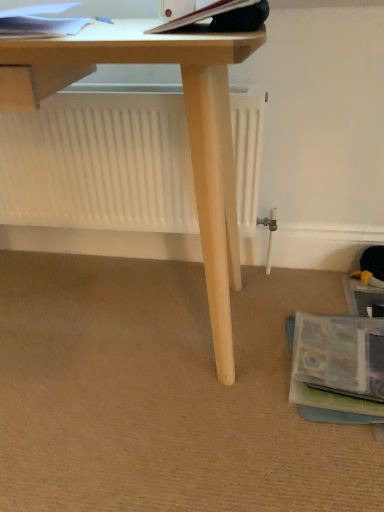
Identify the location of matte paper at upper left, placed as the second paperback book when sorted from right to left. (40, 27).

Image resolution: width=384 pixels, height=512 pixels. Describe the element at coordinates (40, 27) in the screenshot. I see `matte paper at upper left, placed as the second paperback book when sorted from right to left` at that location.

This screenshot has width=384, height=512. Find the location of `hardcover book at upper center, the second paperback book when ordered from left to right`. hardcover book at upper center, the second paperback book when ordered from left to right is located at coordinates (201, 15).

Describe the element at coordinates (201, 15) in the screenshot. The height and width of the screenshot is (512, 384). I see `hardcover book at upper center, the second paperback book when ordered from left to right` at that location.

Locate an element on the screen. The width and height of the screenshot is (384, 512). matte paper at upper left, marked as the 1th paperback book in a left-to-right arrangement is located at coordinates (40, 27).

Consider the image. Which object is positioned more to the left, hardcover book at upper center, marked as the 1th paperback book in a right-to-left arrangement, or matte paper at upper left, marked as the 1th paperback book in a left-to-right arrangement?

matte paper at upper left, marked as the 1th paperback book in a left-to-right arrangement, is more to the left.

In the scene shown: Is hardcover book at upper center, marked as the 1th paperback book in a right-to-left arrangement, positioned in front of matte paper at upper left, placed as the second paperback book when sorted from right to left?

Yes, hardcover book at upper center, marked as the 1th paperback book in a right-to-left arrangement, is closer to the camera.

Which is nearer, [153,30] or [52,25]?

Point [153,30] is positioned closer to the camera compared to point [52,25].

From the picture: From the image's perspective, is hardcover book at upper center, marked as the 1th paperback book in a right-to-left arrangement, above matte paper at upper left, marked as the 1th paperback book in a left-to-right arrangement?

Actually, hardcover book at upper center, marked as the 1th paperback book in a right-to-left arrangement, appears below matte paper at upper left, marked as the 1th paperback book in a left-to-right arrangement, in the image.

From a real-world perspective, is hardcover book at upper center, marked as the 1th paperback book in a right-to-left arrangement, located higher than matte paper at upper left, marked as the 1th paperback book in a left-to-right arrangement?

Yes, from a real-world perspective, hardcover book at upper center, marked as the 1th paperback book in a right-to-left arrangement, is on top of matte paper at upper left, marked as the 1th paperback book in a left-to-right arrangement.

Considering the relative sizes of hardcover book at upper center, the second paperback book when ordered from left to right, and matte paper at upper left, placed as the second paperback book when sorted from right to left, in the image provided, is hardcover book at upper center, the second paperback book when ordered from left to right, thinner than matte paper at upper left, placed as the second paperback book when sorted from right to left,?

Yes, hardcover book at upper center, the second paperback book when ordered from left to right, is thinner than matte paper at upper left, placed as the second paperback book when sorted from right to left.

Between hardcover book at upper center, the second paperback book when ordered from left to right, and matte paper at upper left, marked as the 1th paperback book in a left-to-right arrangement, which one has more height?

With more height is hardcover book at upper center, the second paperback book when ordered from left to right.

In terms of size, does hardcover book at upper center, the second paperback book when ordered from left to right, appear bigger or smaller than matte paper at upper left, placed as the second paperback book when sorted from right to left?

In the image, hardcover book at upper center, the second paperback book when ordered from left to right, appears to be smaller than matte paper at upper left, placed as the second paperback book when sorted from right to left.

Is matte paper at upper left, placed as the second paperback book when sorted from right to left, surrounded by hardcover book at upper center, the second paperback book when ordered from left to right?

That's incorrect, matte paper at upper left, placed as the second paperback book when sorted from right to left, is not inside hardcover book at upper center, the second paperback book when ordered from left to right.

Is hardcover book at upper center, marked as the 1th paperback book in a right-to-left arrangement, positioned far away from matte paper at upper left, marked as the 1th paperback book in a left-to-right arrangement?

That's not correct — hardcover book at upper center, marked as the 1th paperback book in a right-to-left arrangement, is a little close to matte paper at upper left, marked as the 1th paperback book in a left-to-right arrangement.

Could you tell me if hardcover book at upper center, the second paperback book when ordered from left to right, is turned towards matte paper at upper left, marked as the 1th paperback book in a left-to-right arrangement?

No.

How different are the orientations of hardcover book at upper center, the second paperback book when ordered from left to right, and matte paper at upper left, placed as the second paperback book when sorted from right to left, in degrees?

The angular difference between hardcover book at upper center, the second paperback book when ordered from left to right, and matte paper at upper left, placed as the second paperback book when sorted from right to left, is 16 degrees.

Measure the distance between hardcover book at upper center, the second paperback book when ordered from left to right, and matte paper at upper left, placed as the second paperback book when sorted from right to left.

hardcover book at upper center, the second paperback book when ordered from left to right, and matte paper at upper left, placed as the second paperback book when sorted from right to left, are 8.12 inches apart from each other.

What are the coordinates of `paperback book above the hardcover book at upper center, marked as the 1th paperback book in a right-to-left arrangement (from the image's perspective)` in the screenshot? It's located at (40, 27).

Is matte paper at upper left, marked as the 1th paperback book in a left-to-right arrangement, to the left or to the right of hardcover book at upper center, marked as the 1th paperback book in a right-to-left arrangement, in the image?

matte paper at upper left, marked as the 1th paperback book in a left-to-right arrangement, is to the left of hardcover book at upper center, marked as the 1th paperback book in a right-to-left arrangement.

Is the position of matte paper at upper left, marked as the 1th paperback book in a left-to-right arrangement, less distant than that of hardcover book at upper center, marked as the 1th paperback book in a right-to-left arrangement?

A: No, matte paper at upper left, marked as the 1th paperback book in a left-to-right arrangement, is behind hardcover book at upper center, marked as the 1th paperback book in a right-to-left arrangement.

Is point (74, 24) closer to camera compared to point (216, 7)?

That is False.

From the image's perspective, is matte paper at upper left, placed as the second paperback book when sorted from right to left, under hardcover book at upper center, marked as the 1th paperback book in a right-to-left arrangement?

Incorrect, from the image's perspective, matte paper at upper left, placed as the second paperback book when sorted from right to left, is higher than hardcover book at upper center, marked as the 1th paperback book in a right-to-left arrangement.

From a real-world perspective, is matte paper at upper left, placed as the second paperback book when sorted from right to left, physically above hardcover book at upper center, marked as the 1th paperback book in a right-to-left arrangement?

Incorrect, from a real-world perspective, matte paper at upper left, placed as the second paperback book when sorted from right to left, is lower than hardcover book at upper center, marked as the 1th paperback book in a right-to-left arrangement.

Does matte paper at upper left, marked as the 1th paperback book in a left-to-right arrangement, have a lesser width compared to hardcover book at upper center, marked as the 1th paperback book in a right-to-left arrangement?

Incorrect, the width of matte paper at upper left, marked as the 1th paperback book in a left-to-right arrangement, is not less than that of hardcover book at upper center, marked as the 1th paperback book in a right-to-left arrangement.

Which of these two, matte paper at upper left, marked as the 1th paperback book in a left-to-right arrangement, or hardcover book at upper center, the second paperback book when ordered from left to right, stands taller?

hardcover book at upper center, the second paperback book when ordered from left to right.

Consider the image. Can you confirm if matte paper at upper left, marked as the 1th paperback book in a left-to-right arrangement, is smaller than hardcover book at upper center, marked as the 1th paperback book in a right-to-left arrangement?

No.

Would you say hardcover book at upper center, marked as the 1th paperback book in a right-to-left arrangement, is part of matte paper at upper left, marked as the 1th paperback book in a left-to-right arrangement,'s contents?

No, hardcover book at upper center, marked as the 1th paperback book in a right-to-left arrangement, is located outside of matte paper at upper left, marked as the 1th paperback book in a left-to-right arrangement.

Is matte paper at upper left, placed as the second paperback book when sorted from right to left, far from hardcover book at upper center, the second paperback book when ordered from left to right?

No, matte paper at upper left, placed as the second paperback book when sorted from right to left, is in close proximity to hardcover book at upper center, the second paperback book when ordered from left to right.

Is matte paper at upper left, placed as the second paperback book when sorted from right to left, turned away from hardcover book at upper center, marked as the 1th paperback book in a right-to-left arrangement?

matte paper at upper left, placed as the second paperback book when sorted from right to left, does not have its back to hardcover book at upper center, marked as the 1th paperback book in a right-to-left arrangement.

Could you measure the distance between matte paper at upper left, placed as the second paperback book when sorted from right to left, and hardcover book at upper center, the second paperback book when ordered from left to right?

A distance of 20.64 centimeters exists between matte paper at upper left, placed as the second paperback book when sorted from right to left, and hardcover book at upper center, the second paperback book when ordered from left to right.

Locate an element on the screen. The width and height of the screenshot is (384, 512). paperback book below the matte paper at upper left, marked as the 1th paperback book in a left-to-right arrangement (from the image's perspective) is located at coordinates (201, 15).

I want to click on paperback book on the right of the matte paper at upper left, marked as the 1th paperback book in a left-to-right arrangement, so click(201, 15).

Find the location of a particular element. The image size is (384, 512). paperback book positioned vertically above the matte paper at upper left, placed as the second paperback book when sorted from right to left (from a real-world perspective) is located at coordinates (201, 15).